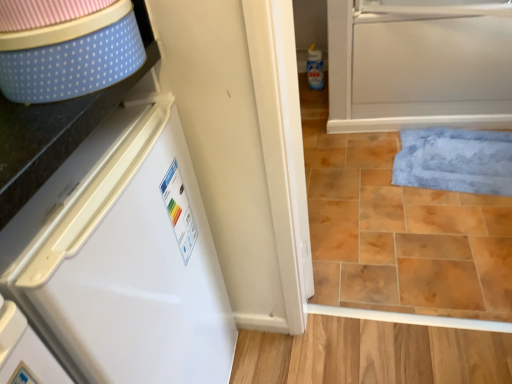
Question: From their relative heights in the image, would you say blue plush bath mat at lower right is taller or shorter than white glossy refrigerator at left?

Choices:
 (A) short
 (B) tall

Answer: (A)

Question: From the image's perspective, is blue plush bath mat at lower right positioned above or below white glossy refrigerator at left?

Choices:
 (A) above
 (B) below

Answer: (A)

Question: Is point (438, 150) closer or farther from the camera than point (129, 251)?

Choices:
 (A) farther
 (B) closer

Answer: (A)

Question: Considering the positions of point (25, 296) and point (412, 132), is point (25, 296) closer or farther from the camera than point (412, 132)?

Choices:
 (A) farther
 (B) closer

Answer: (B)

Question: Relative to blue plush bath mat at lower right, is white glossy refrigerator at left in front or behind?

Choices:
 (A) behind
 (B) front

Answer: (B)

Question: Looking at the image, does white glossy refrigerator at left seem bigger or smaller compared to blue plush bath mat at lower right?

Choices:
 (A) big
 (B) small

Answer: (A)

Question: Is white glossy refrigerator at left inside the boundaries of blue plush bath mat at lower right, or outside?

Choices:
 (A) inside
 (B) outside

Answer: (B)